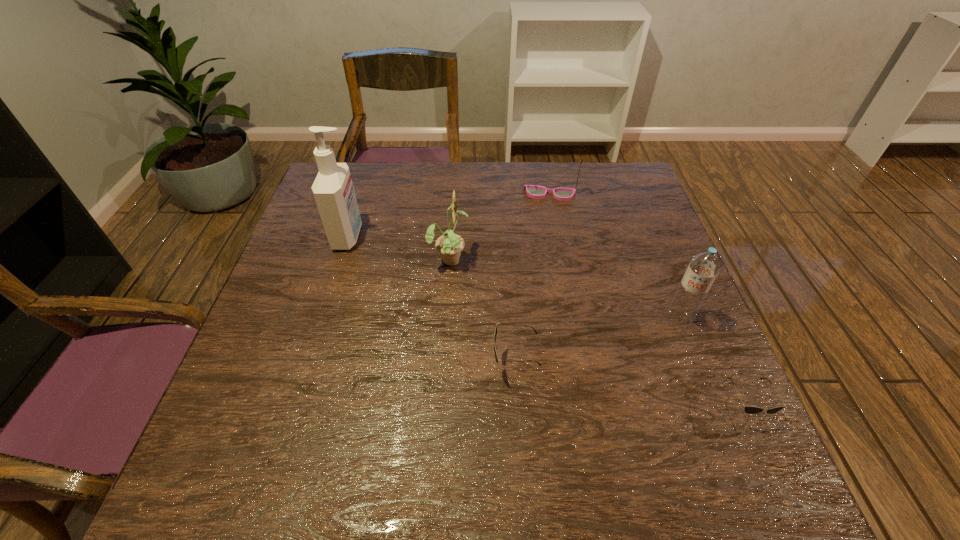
This screenshot has height=540, width=960. What are the coordinates of `free space between the water bottle and the tallest object` in the screenshot? It's located at (514, 278).

This screenshot has height=540, width=960. Find the location of `free space between the right sunglasses and the second shortest object`. free space between the right sunglasses and the second shortest object is located at coordinates click(x=628, y=387).

This screenshot has width=960, height=540. Identify the location of free spot between the right sunglasses and the spectacles. (646, 301).

This screenshot has width=960, height=540. I want to click on free space between the water bottle and the sunflower, so click(x=564, y=289).

Locate an element on the screen. free space between the spectacles and the water bottle is located at coordinates (614, 256).

Identify the location of free space between the shorter sunglasses and the leftmost object. This screenshot has width=960, height=540. (545, 322).

Select which object appears as the closest to the fifth tallest object. Please provide its 2D coordinates. Your answer should be formatted as a tuple, i.e. [(x, y)], where the tuple contains the x and y coordinates of a point satisfying the conditions above.

[(449, 245)]

At what (x,y) coordinates should I click in order to perform the action: click on object that is the fourth closest to the farthest object. Please return your answer as a coordinate pair (x, y). Looking at the image, I should click on (495, 331).

Locate an element on the screen. Image resolution: width=960 pixels, height=540 pixels. free point that satisfies the following two spatial constraints: 1. on the back side of the water bottle; 2. on the front-facing side of the sunflower is located at coordinates pyautogui.click(x=655, y=259).

Where is `free location that satisfies the following two spatial constraints: 1. on the front side of the farthest object; 2. in front of the lenses of the taller sunglasses`? The height and width of the screenshot is (540, 960). free location that satisfies the following two spatial constraints: 1. on the front side of the farthest object; 2. in front of the lenses of the taller sunglasses is located at coordinates (581, 364).